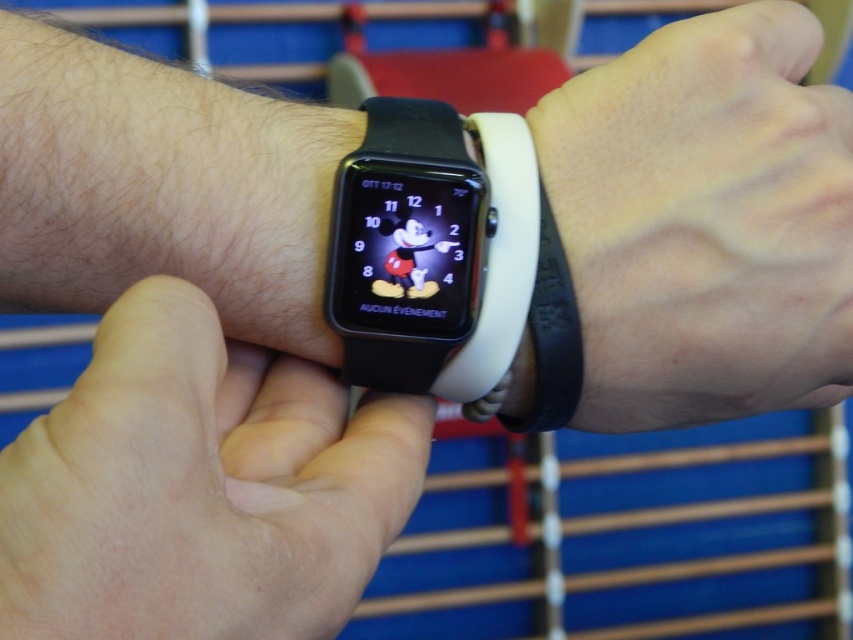
You are a fashion stylist helping a client choose between two wrist accessories. The client wants to know which of the two items, the skinny white wristband at center or the black rubber watch at center, is positioned closer to their left side. Based on the image description, which one is on the left?

The skinny white wristband at center is positioned to the left of the black rubber watch at center, so it is closer to the client left side.

You are a watch repair technician examining a wrist with two smartwatches. You need to adjust the position of the black matte wristband at lower right and the black rubber watch at center. Which one should you move to the left to make space for the other?

The black matte wristband at lower right is to the right of the black rubber watch at center. To make space, you should move the black matte wristband at lower right to the left.